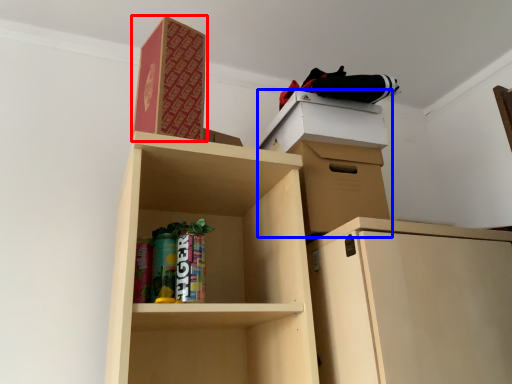
Question: Which object appears closest to the camera in this image, paperback book (highlighted by a red box) or cabinetry (highlighted by a blue box)?

Choices:
 (A) paperback book
 (B) cabinetry

Answer: (A)